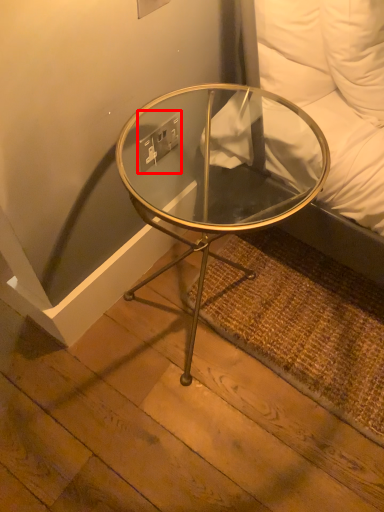
Question: Considering the relative positions of electric outlet (annotated by the red box) and coffee table in the image provided, where is electric outlet (annotated by the red box) located with respect to the staircase?

Choices:
 (A) right
 (B) left

Answer: (B)